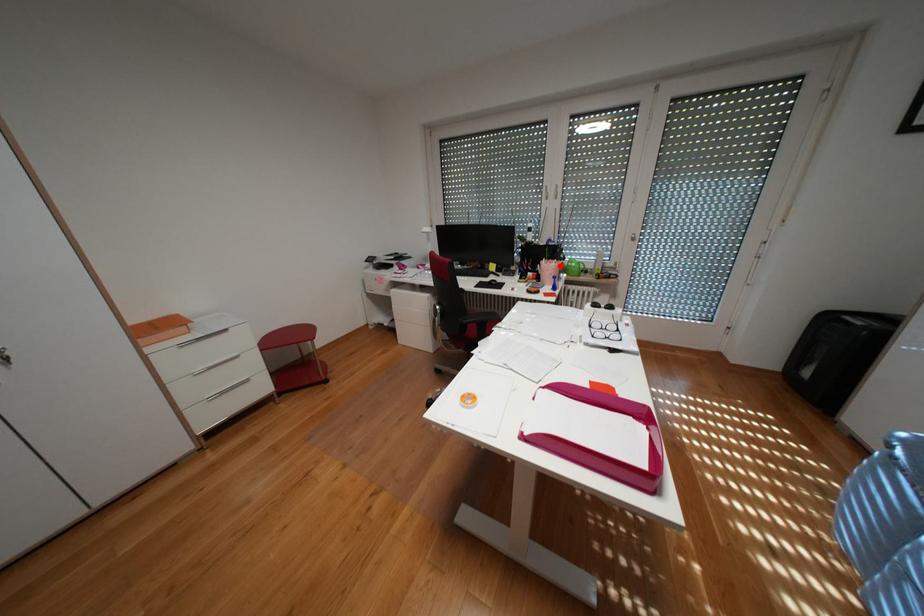
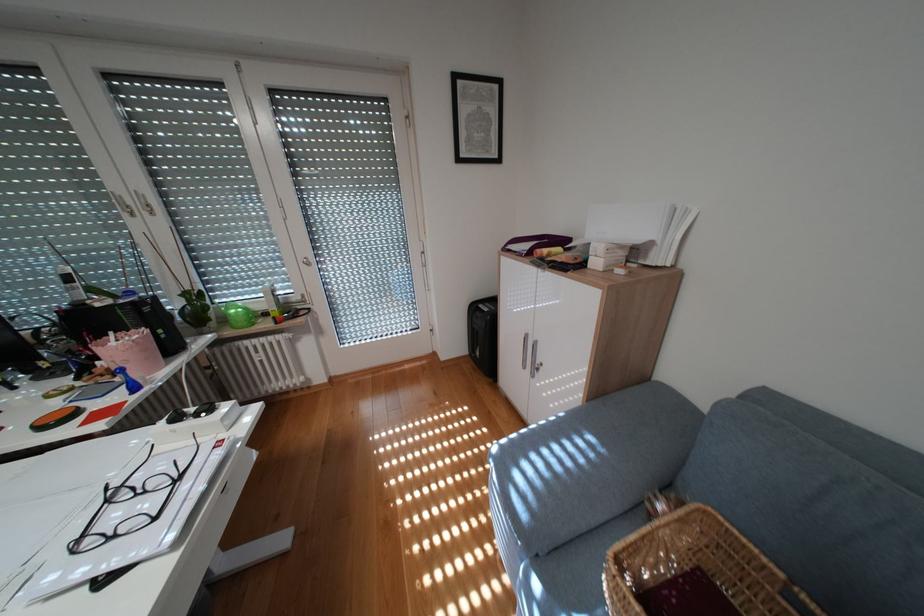
Question: I am providing you with two images of the same scene from different viewpoints. Given a red point in image1, look at the same physical point in image2. Is it:

Choices:
 (A) Closer to the viewpoint
 (B) Farther from the viewpoint

Answer: (B)